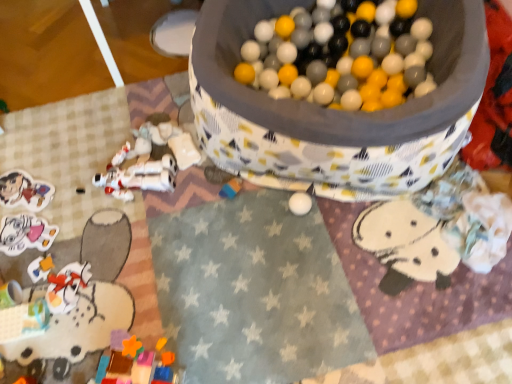
Question: Are multicolored plastic blocks at center, acting as the 5th toy starting from the left, and fluffy white blanket at lower right, arranged as the 1th toy when viewed from the right, far apart?

Choices:
 (A) yes
 (B) no

Answer: (B)

Question: Is the position of multicolored plastic blocks at center, acting as the 5th toy starting from the left, less distant than that of fluffy white blanket at lower right, which appears as the sixth toy when viewed from the left?

Choices:
 (A) yes
 (B) no

Answer: (B)

Question: Does multicolored plastic blocks at center, the 2th toy positioned from the right, appear on the right side of fluffy white blanket at lower right, arranged as the 1th toy when viewed from the right?

Choices:
 (A) no
 (B) yes

Answer: (A)

Question: From a real-world perspective, is multicolored plastic blocks at center, the 2th toy positioned from the right, physically below fluffy white blanket at lower right, which appears as the sixth toy when viewed from the left?

Choices:
 (A) no
 (B) yes

Answer: (B)

Question: Does multicolored plastic blocks at center, the 2th toy positioned from the right, have a lesser height compared to fluffy white blanket at lower right, arranged as the 1th toy when viewed from the right?

Choices:
 (A) no
 (B) yes

Answer: (B)

Question: Considering the relative sizes of multicolored plastic blocks at center, acting as the 5th toy starting from the left, and fluffy white blanket at lower right, which appears as the sixth toy when viewed from the left, in the image provided, is multicolored plastic blocks at center, acting as the 5th toy starting from the left, thinner than fluffy white blanket at lower right, which appears as the sixth toy when viewed from the left,?

Choices:
 (A) yes
 (B) no

Answer: (A)

Question: Is white plastic astronaut at lower left, placed as the 3th toy when sorted from right to left, wider than multicolored plastic blocks at center, the 2th toy positioned from the right?

Choices:
 (A) no
 (B) yes

Answer: (B)

Question: Is white plastic astronaut at lower left, placed as the 4th toy when sorted from left to right, at the left side of multicolored plastic blocks at center, the 2th toy positioned from the right?

Choices:
 (A) no
 (B) yes

Answer: (B)

Question: Can you confirm if white plastic astronaut at lower left, placed as the 4th toy when sorted from left to right, is positioned to the right of multicolored plastic blocks at center, the 2th toy positioned from the right?

Choices:
 (A) no
 (B) yes

Answer: (A)

Question: Is white plastic astronaut at lower left, placed as the 3th toy when sorted from right to left, touching multicolored plastic blocks at center, acting as the 5th toy starting from the left?

Choices:
 (A) no
 (B) yes

Answer: (A)

Question: From a real-world perspective, is white plastic astronaut at lower left, placed as the 4th toy when sorted from left to right, positioned under multicolored plastic blocks at center, acting as the 5th toy starting from the left, based on gravity?

Choices:
 (A) no
 (B) yes

Answer: (A)

Question: From the image's perspective, would you say white plastic astronaut at lower left, placed as the 4th toy when sorted from left to right, is shown under multicolored plastic blocks at center, the 2th toy positioned from the right?

Choices:
 (A) no
 (B) yes

Answer: (A)

Question: From a real-world perspective, is matte cardboard sticker at lower left, which is the first toy in left-to-right order, below matte white sticker at lower left, which appears as the 2th toy when viewed from the left?

Choices:
 (A) yes
 (B) no

Answer: (A)